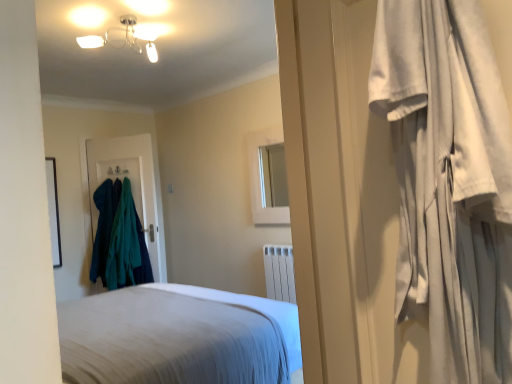
The height and width of the screenshot is (384, 512). I want to click on vacant space underneath metallic glass chandelier at upper center (from a real-world perspective), so (x=158, y=299).